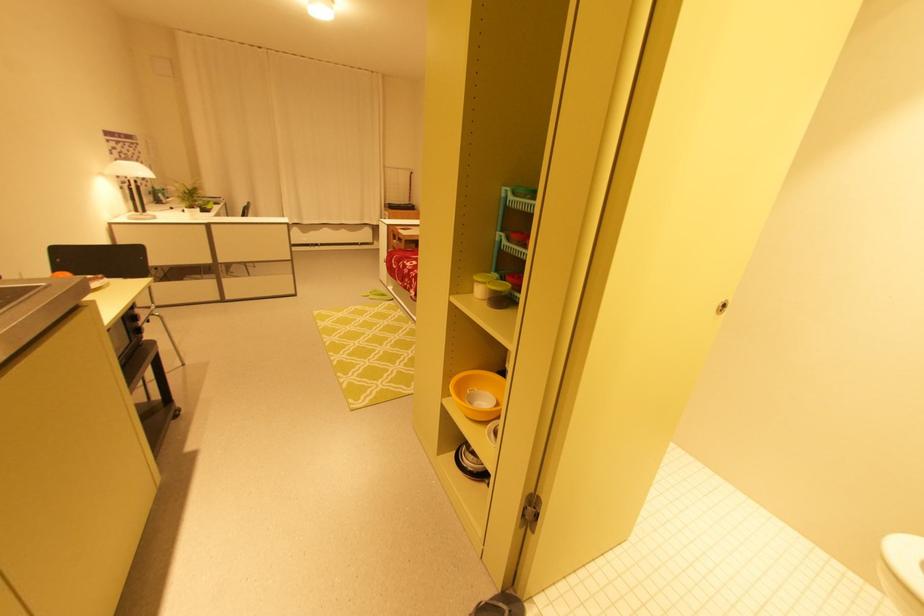
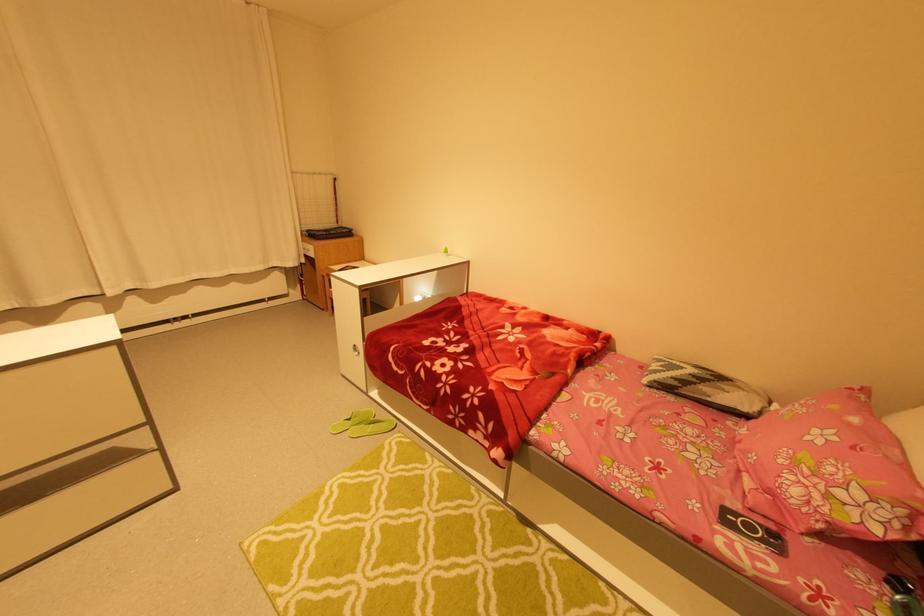
Find the pixel in the second image that matches pixel 377 293 in the first image.

(354, 419)